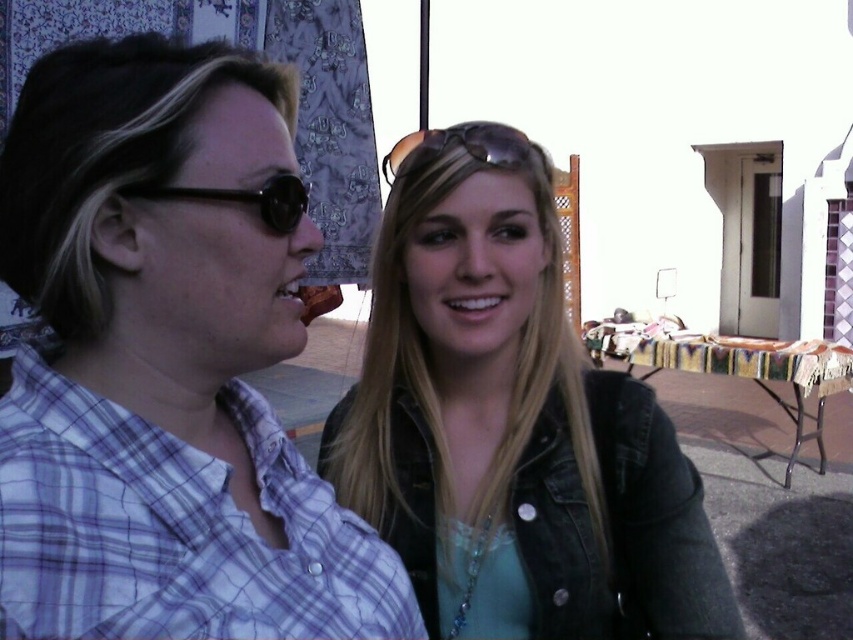
You are a photographer holding a camera and want to take a photo of the plaid shirt at left without moving the camera. Can you do that?

The plaid shirt at left and camera are 20.59 inches apart from each other, so yes, the photographer can take a photo of the plaid shirt at left without moving the camera since the distance is manageable for a photo.

You are standing in front of the table with textiles and want to place two markers at coordinates point (x=183, y=72) and point (x=274, y=196). Which marker will be closer to you?

Point (x=183, y=72) is closer to the viewer than point (x=274, y=196), so the marker at point (x=183, y=72) will be closer to you.